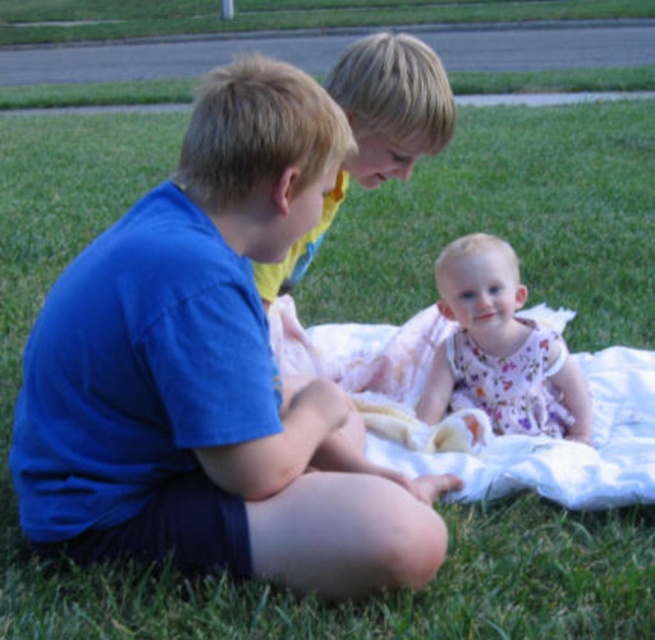
Is white cotton blanket at center above floral dress at center?

Correct, white cotton blanket at center is located above floral dress at center.

Is point (605, 412) closer to viewer compared to point (458, 243)?

That is False.

At what (x,y) coordinates should I click in order to perform the action: click on white cotton blanket at center. Please return your answer as a coordinate pair (x, y). Looking at the image, I should click on (479, 413).

The height and width of the screenshot is (640, 655). What do you see at coordinates (479, 413) in the screenshot? I see `white cotton blanket at center` at bounding box center [479, 413].

In order to click on white cotton blanket at center in this screenshot , I will do `click(479, 413)`.

Which is below, floral dress at center or smooth blonde hair at center?

Positioned lower is floral dress at center.

Between floral dress at center and smooth blonde hair at center, which one has less height?

With less height is floral dress at center.

In the scene shown: Who is more forward, [533,324] or [354,124]?

Positioned in front is point [354,124].

Where is `floral dress at center`? The image size is (655, 640). floral dress at center is located at coordinates (500, 348).